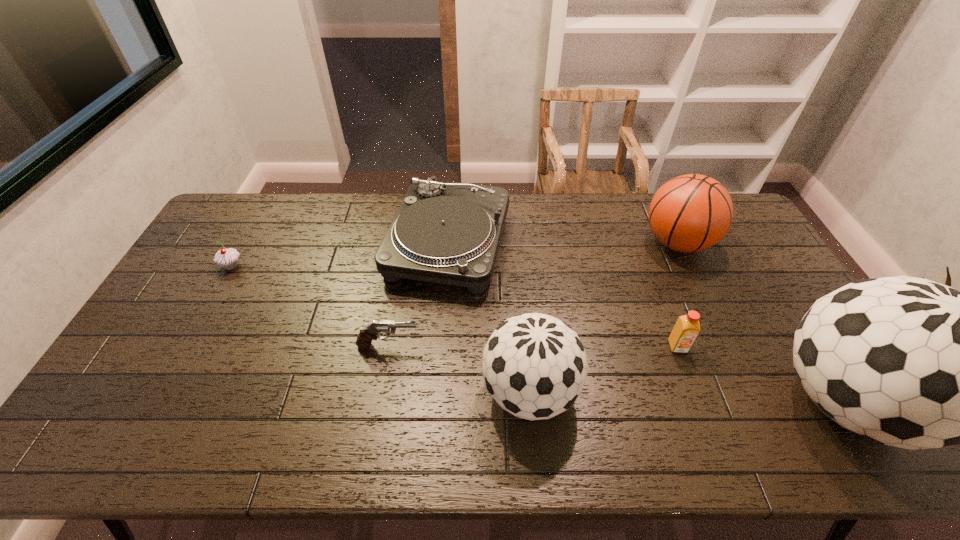
In the current image, all soccer balls are evenly spaced. To maintain this equal spacing, where should an additional soccer ball be placed on the left? Please point out a free spot. Please provide its 2D coordinates. Your answer should be formatted as a tuple, i.e. [(x, y)], where the tuple contains the x and y coordinates of a point satisfying the conditions above.

[(225, 383)]